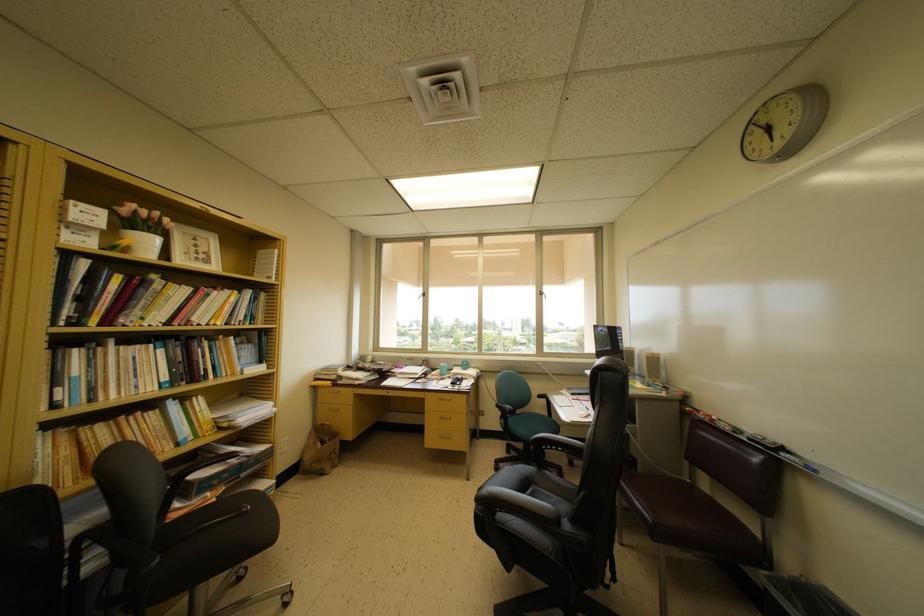
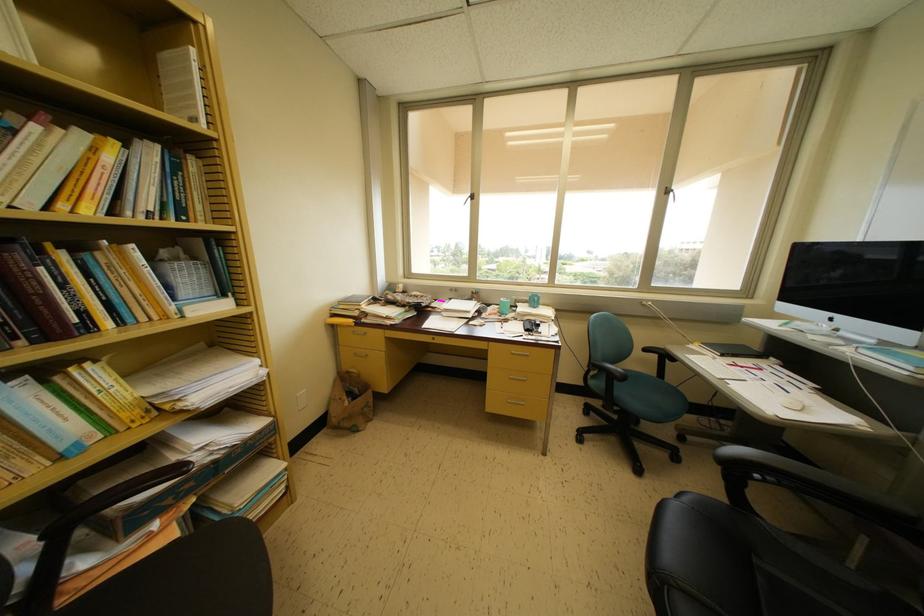
Find the pixel in the second image that matches pixel 334 387 in the first image.

(355, 326)